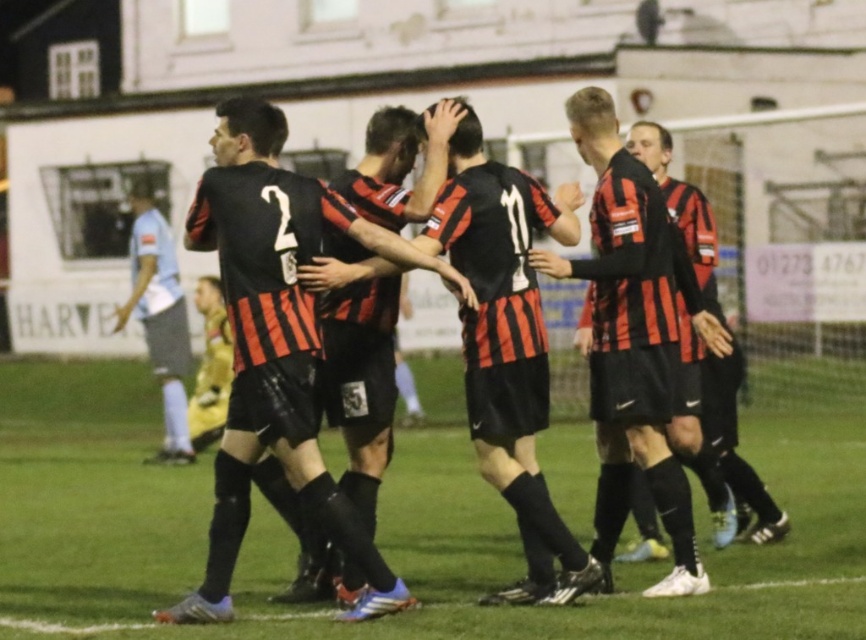
Question: Is black matte jersey at center positioned in front of matte black jersey at center?

Choices:
 (A) no
 (B) yes

Answer: (B)

Question: Which of these objects is positioned closest to the black matte jersey at center?

Choices:
 (A) green grass at center
 (B) matte black jersey at center

Answer: (B)

Question: Does black matte jersey at center appear on the left side of matte black jersey at center?

Choices:
 (A) no
 (B) yes

Answer: (B)

Question: Does green grass at center have a larger size compared to matte black jersey at center?

Choices:
 (A) yes
 (B) no

Answer: (A)

Question: Considering the real-world distances, which object is closest to the green grass at center?

Choices:
 (A) matte black jersey at center
 (B) black matte jersey at center

Answer: (B)

Question: Based on their relative distances, which object is farther from the black matte jersey at center?

Choices:
 (A) matte black jersey at center
 (B) green grass at center

Answer: (B)